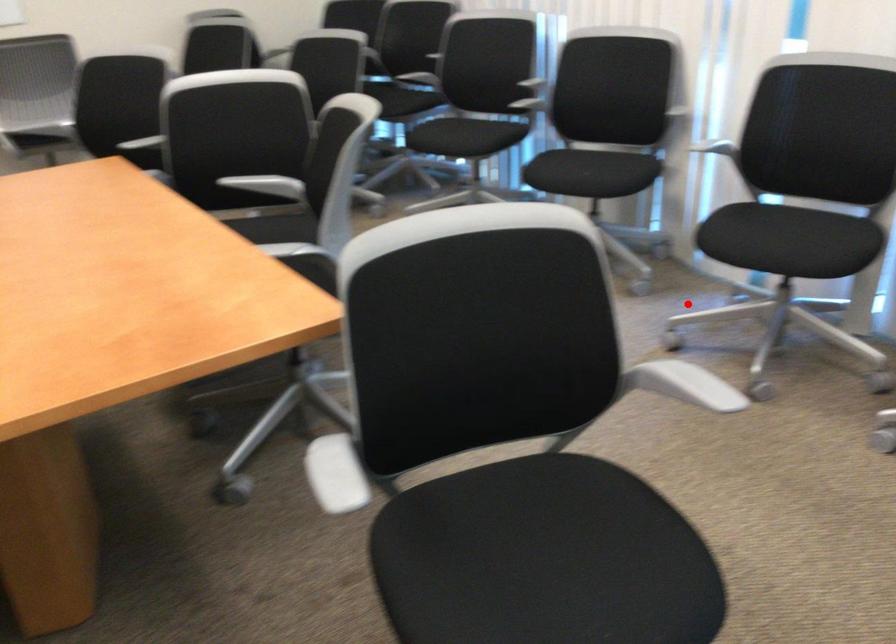
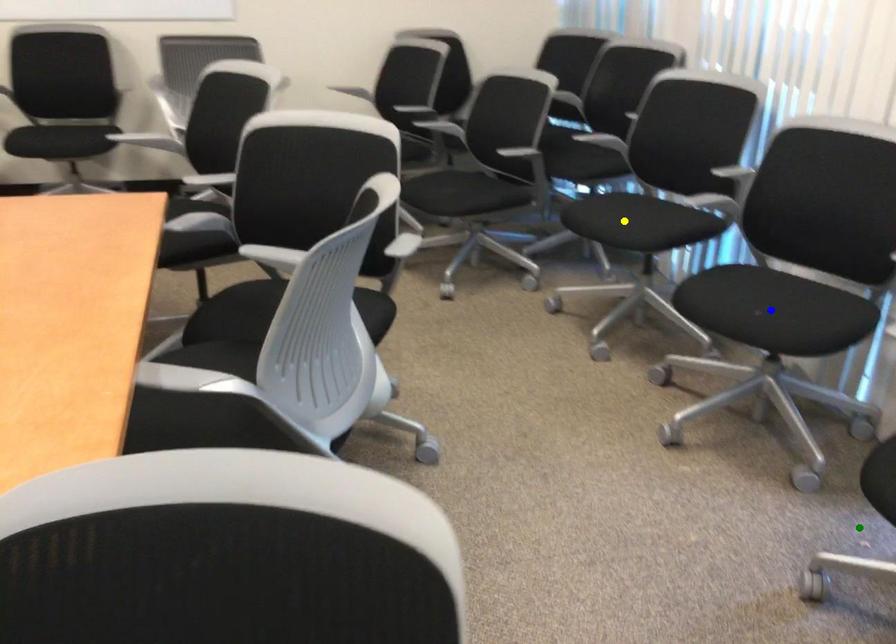
Question: I am providing you with two images of the same scene from different viewpoints. A red point is marked on the first image. You are given multiple points on the second image. Which spot in image 2 lines up with the point in image 1?

Choices:
 (A) blue point
 (B) yellow point
 (C) green point

Answer: (C)